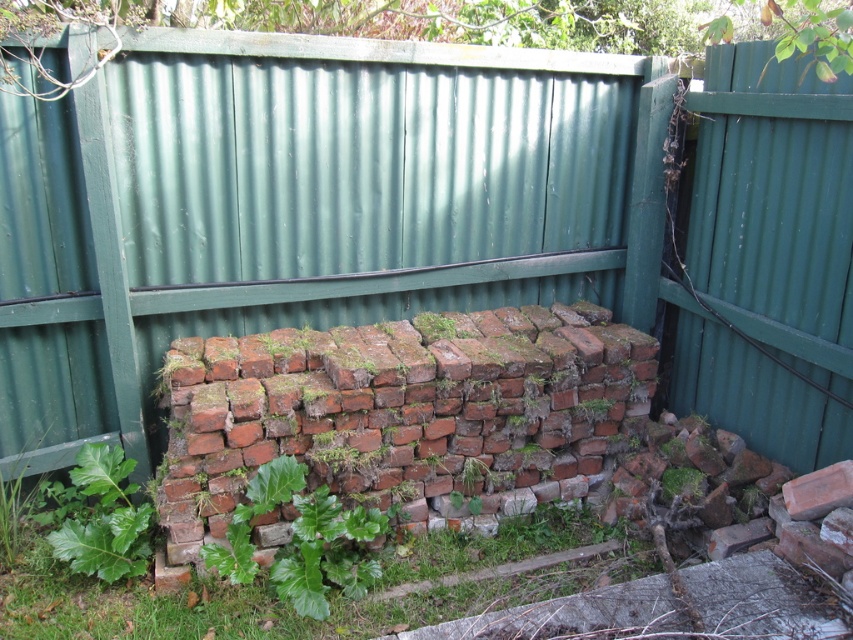
You are standing at the point labeled as point (326, 595) in the garden scene. What type of surface are you currently standing on?

The point (326, 595) is on green leafy grass at lower center, so you are standing on green leafy grass.

You are a gardener who wants to plant a new flower between the green leafy grass at lower center and the green leafy plant at center. Which one should you place the flower closer to so it doesn

The green leafy grass at lower center is shorter than the green leafy plant at center, so you should place the flower closer to the green leafy grass at lower center to ensure it gets enough sunlight.